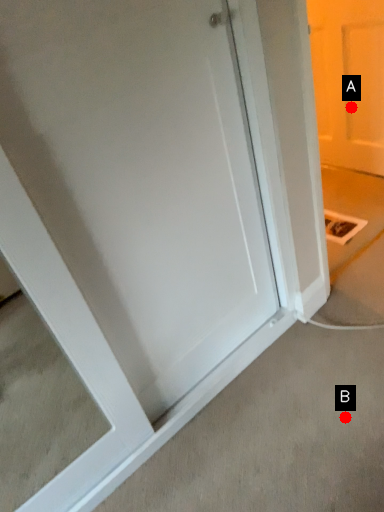
Question: Two points are circled on the image, labeled by A and B beside each circle. Which of the following is the closest to the observer?

Choices:
 (A) A is closer
 (B) B is closer

Answer: (B)